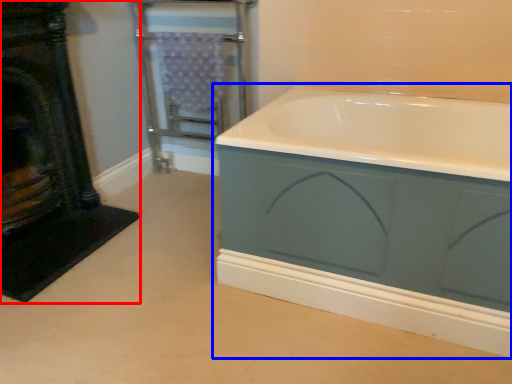
Question: Which object is further to the camera taking this photo, fireplace (highlighted by a red box) or bathtub (highlighted by a blue box)?

Choices:
 (A) fireplace
 (B) bathtub

Answer: (A)